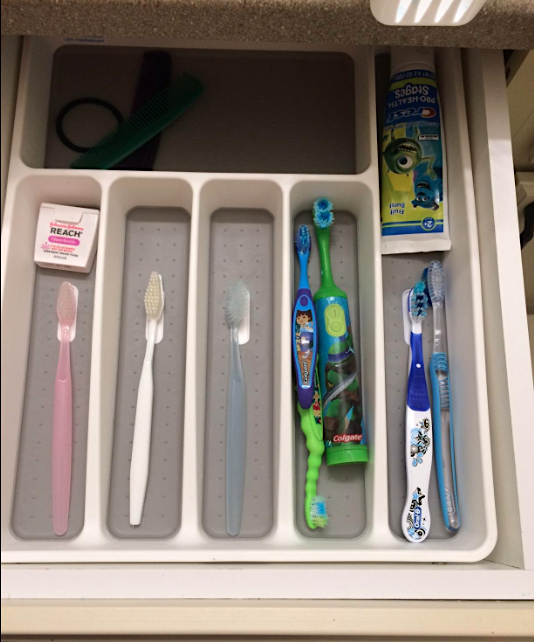
Find the location of a particular element. manual brush is located at coordinates (302, 317), (317, 447), (239, 411), (143, 402), (66, 406), (421, 424), (445, 394).